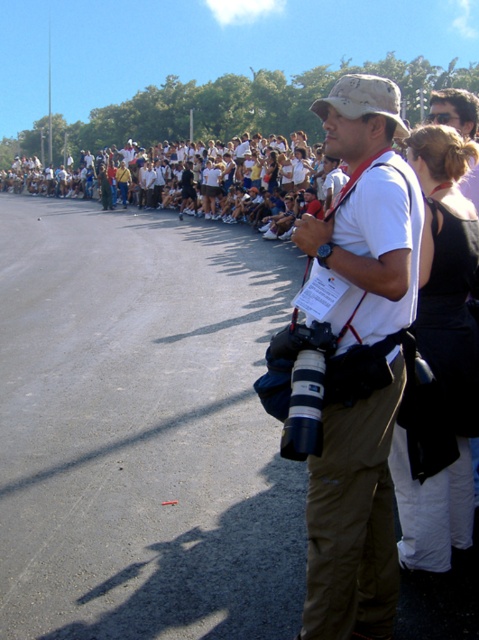
You are a photographer at the event and need to capture a clear shot of both the white cotton shirt at center and the yellow fabric shirt at center. Which one will appear larger in your photo?

The white cotton shirt at center will appear larger in the photo because it is taller than the yellow fabric shirt at center.

You are standing at point (358, 358) in the image. What object are you currently standing on?

You are standing on the white cotton shirt at center.

You are a participant in the event and want to locate the white cotton shirt at center and the yellow fabric shirt at center. Which one is lower in the image?

The white cotton shirt at center is below the yellow fabric shirt at center, so the white cotton shirt at center is lower in the image.